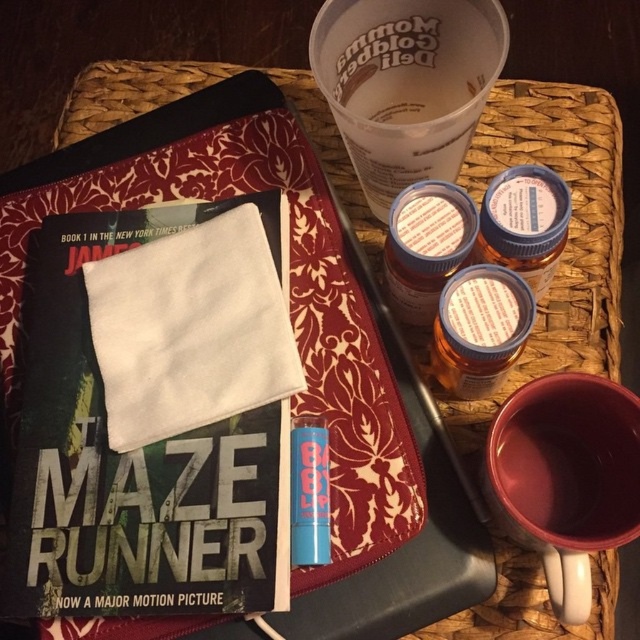
Does reddish-brown fabric tray at upper center appear under hardcover book at center?

No, reddish-brown fabric tray at upper center is not below hardcover book at center.

Is reddish-brown fabric tray at upper center further to the viewer compared to hardcover book at center?

Yes.

Is point (312, 596) closer to camera compared to point (84, 531)?

No.

Find the location of a particular element. This screenshot has height=640, width=640. reddish-brown fabric tray at upper center is located at coordinates (298, 348).

Who is lower down, reddish-brown fabric tray at upper center or matte ceramic mug at lower right?

matte ceramic mug at lower right is below.

I want to click on reddish-brown fabric tray at upper center, so click(298, 348).

Is reddish-brown fabric tray at upper center above clear plastic cup at upper center?

Incorrect, reddish-brown fabric tray at upper center is not positioned above clear plastic cup at upper center.

The height and width of the screenshot is (640, 640). What do you see at coordinates (298, 348) in the screenshot?
I see `reddish-brown fabric tray at upper center` at bounding box center [298, 348].

Where is `reddish-brown fabric tray at upper center`? reddish-brown fabric tray at upper center is located at coordinates (298, 348).

At what (x,y) coordinates should I click in order to perform the action: click on reddish-brown fabric tray at upper center. Please return your answer as a coordinate pair (x, y). The width and height of the screenshot is (640, 640). Looking at the image, I should click on (298, 348).